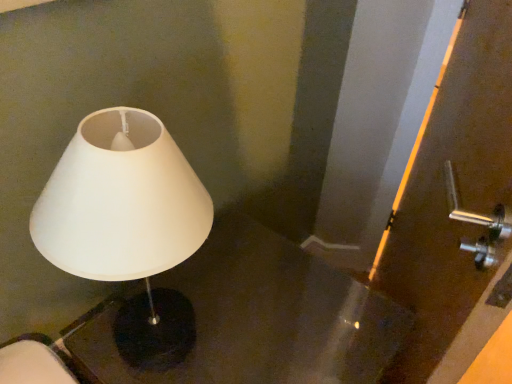
Question: Does point (456, 64) appear closer or farther from the camera than point (192, 340)?

Choices:
 (A) farther
 (B) closer

Answer: (A)

Question: Based on their positions, is matte brown screen door at right located to the left or right of white matte lampshade at left?

Choices:
 (A) left
 (B) right

Answer: (B)

Question: Which object is positioned closest to the matte brown screen door at right?

Choices:
 (A) black glossy table at left
 (B) white matte lampshade at left

Answer: (A)

Question: Which object is positioned closest to the black glossy table at left?

Choices:
 (A) white matte lampshade at left
 (B) matte brown screen door at right

Answer: (B)